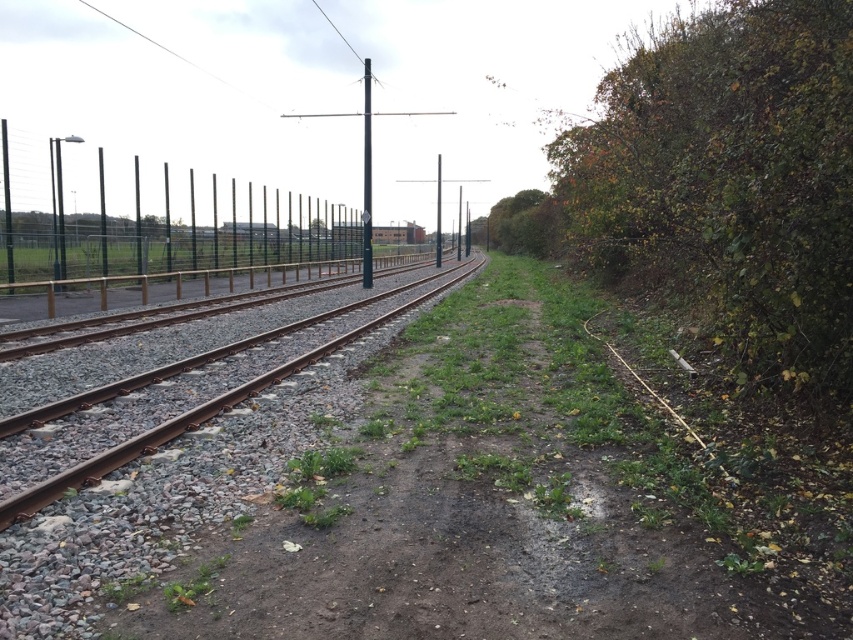
Between point (811, 305) and point (505, 236), which one is positioned in front?

Positioned in front is point (811, 305).

The height and width of the screenshot is (640, 853). Find the location of `green leafy bush at right`. green leafy bush at right is located at coordinates click(x=729, y=180).

Is rusty metal track at center to the left of black metal pole at center from the viewer's perspective?

No, rusty metal track at center is not to the left of black metal pole at center.

Looking at this image, does rusty metal track at center have a lesser height compared to black metal pole at center?

Yes, rusty metal track at center is shorter than black metal pole at center.

Describe the element at coordinates (190, 419) in the screenshot. I see `rusty metal track at center` at that location.

Find the location of `rusty metal track at center`. rusty metal track at center is located at coordinates (190, 419).

Is black metal pole at center to the left of smooth black pole at center from the viewer's perspective?

Indeed, black metal pole at center is positioned on the left side of smooth black pole at center.

Between point (364, 268) and point (439, 225), which one is positioned behind?

The point (439, 225) is behind.

Locate an element on the screen. black metal pole at center is located at coordinates (366, 180).